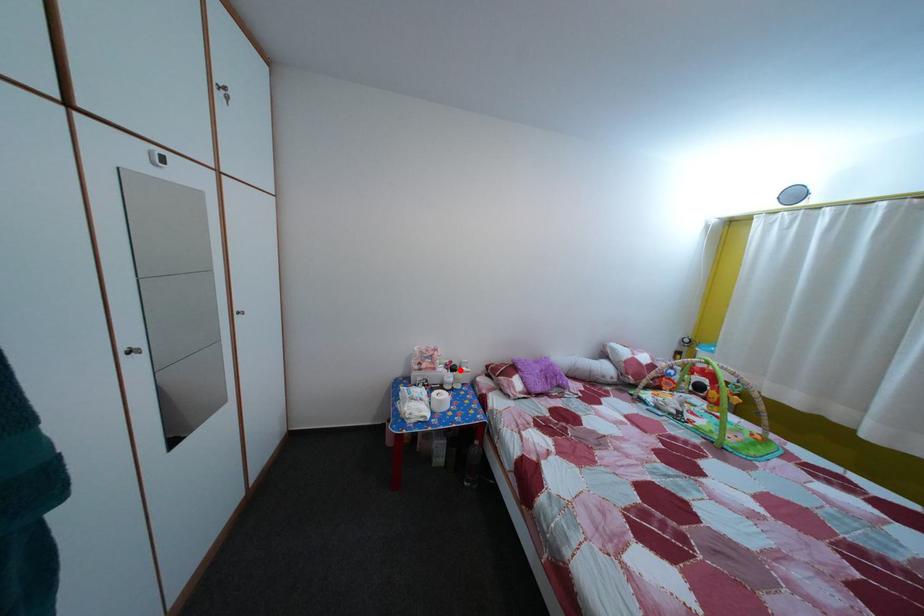
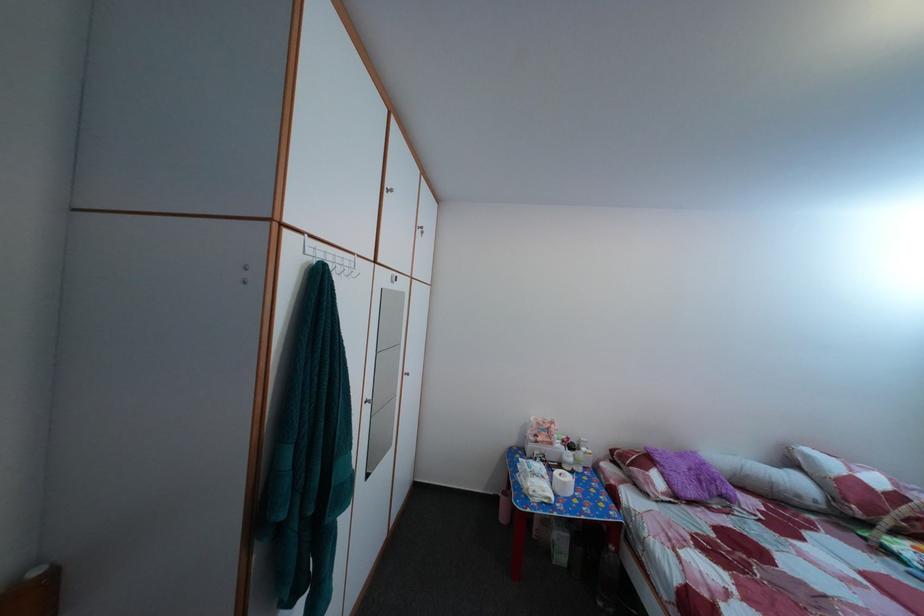
Where in the second image is the point corresponding to the highlighted location from the first image?

(578, 447)